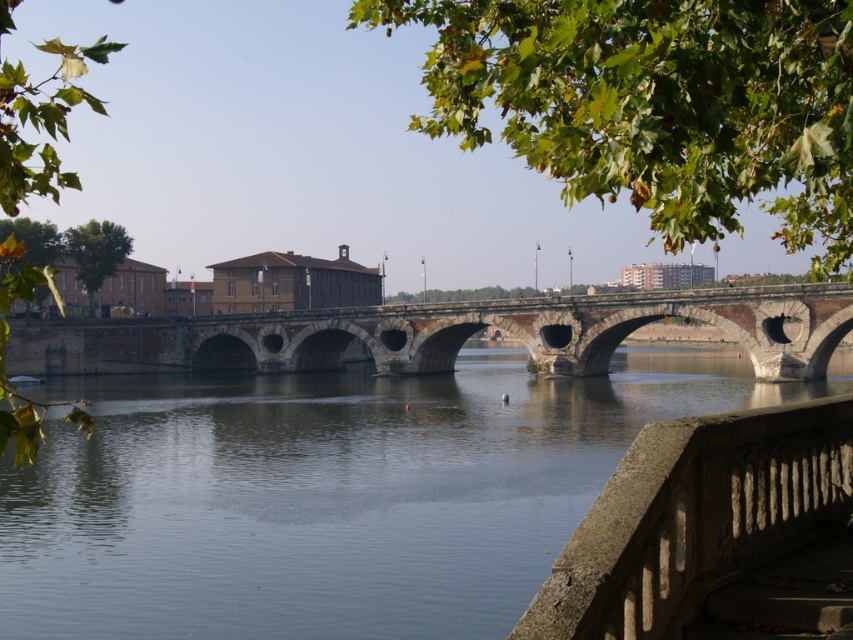
Based on the photo, you are standing at the riverside and want to reach the point marked as point (525, 614). Given that the distance from you to this point is 57.12 feet, can you estimate how far you need to walk to reach it?

The point (525, 614) is 57.12 feet away from the viewer, so you need to walk approximately 57.12 feet to reach it.

You are standing at the center of the historic stone bridge and want to find the gray stone balustrade at lower right. According to the coordinates provided, in which direction should you look to locate it?

The gray stone balustrade at lower right is located at point [695,516], which corresponds to the lower right direction from your current position at the center of the historic stone bridge.

You are standing on the stone railing with decorative balusters in the foreground of the riverside scene. You notice a point marked at coordinates [332,493]. Based on the scene, where is this point located?

The point at coordinates [332,493] is located on clear water at bridge center.